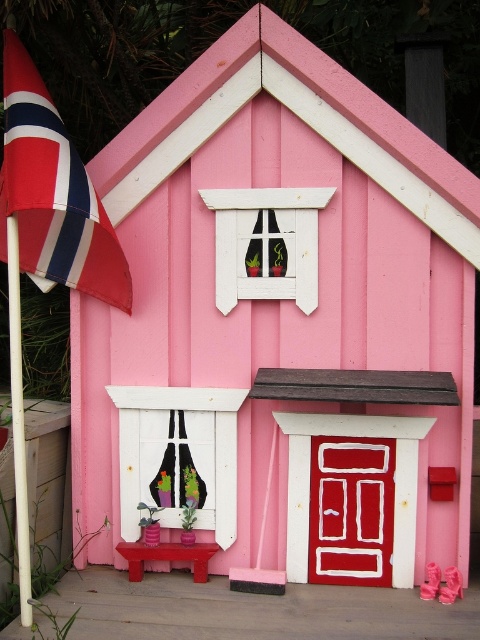
Question: Which object appears closest to the camera in this image?

Choices:
 (A) pink matte flower pot at lower center
 (B) matte pink shoes at lower right
 (C) red and white striped flag at left

Answer: (C)

Question: Among these objects, which one is nearest to the camera?

Choices:
 (A) matte pink shoes at lower right
 (B) red and white striped flag at left

Answer: (B)

Question: Is matte pink shoes at lower right below pink matte flower pot at lower center?

Choices:
 (A) yes
 (B) no

Answer: (A)

Question: Considering the real-world distances, which object is closest to the pink matte flower pot at lower center?

Choices:
 (A) red and white striped flag at left
 (B) matte pink shoes at lower right

Answer: (B)

Question: Is red and white striped flag at left bigger than pink matte flower pot at lower center?

Choices:
 (A) no
 (B) yes

Answer: (B)

Question: Does red and white striped flag at left come in front of pink matte flower pot at lower center?

Choices:
 (A) no
 (B) yes

Answer: (B)